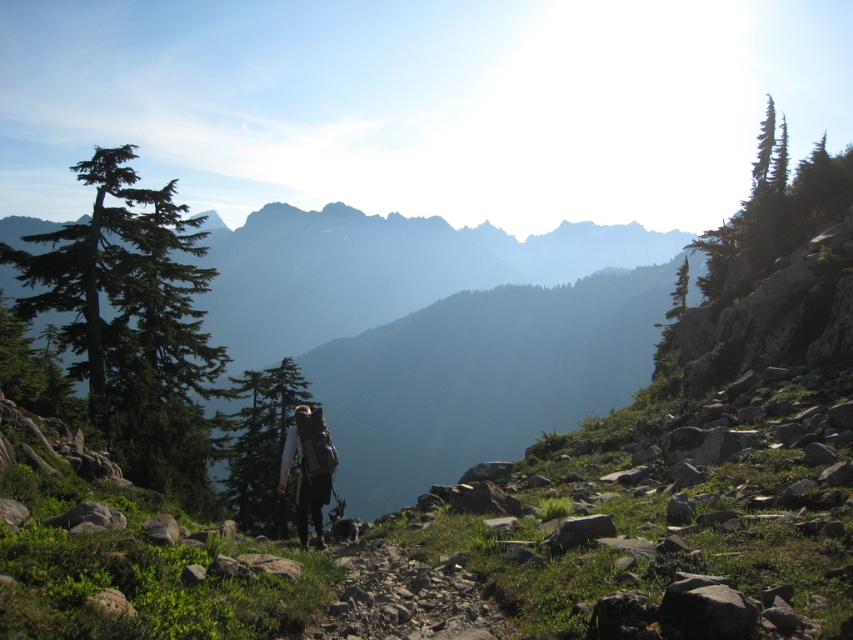
Is green matte evergreen tree at left closer to camera compared to green textured pine tree at upper right?

Yes, green matte evergreen tree at left is in front of green textured pine tree at upper right.

Who is more forward, (108, 324) or (717, 237)?

Positioned in front is point (108, 324).

Where is `green matte evergreen tree at left`? This screenshot has height=640, width=853. green matte evergreen tree at left is located at coordinates [x=134, y=323].

Who is shorter, green grassy mountain at center or green matte evergreen tree at left?

green matte evergreen tree at left is shorter.

Can you confirm if green grassy mountain at center is positioned to the right of green matte evergreen tree at left?

Indeed, green grassy mountain at center is positioned on the right side of green matte evergreen tree at left.

Identify the location of green grassy mountain at center. The width and height of the screenshot is (853, 640). (439, 333).

Which is more to the right, green textured pine tree at upper right or green matte tree at center?

From the viewer's perspective, green textured pine tree at upper right appears more on the right side.

Between green textured pine tree at upper right and green matte tree at center, which one has more height?

With more height is green textured pine tree at upper right.

Between point (767, 250) and point (247, 518), which one is positioned in front?

Point (247, 518)

This screenshot has height=640, width=853. In order to click on green textured pine tree at upper right in this screenshot , I will do [x=776, y=205].